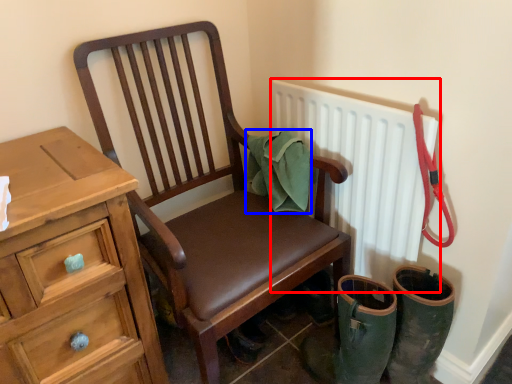
Question: Which object appears farthest to the camera in this image, radiator (highlighted by a red box) or material (highlighted by a blue box)?

Choices:
 (A) radiator
 (B) material

Answer: (B)